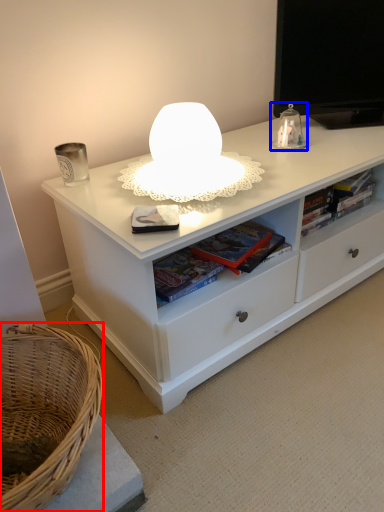
Question: Which point is further to the camera, basket (highlighted by a red box) or table lamp (highlighted by a blue box)?

Choices:
 (A) basket
 (B) table lamp

Answer: (B)